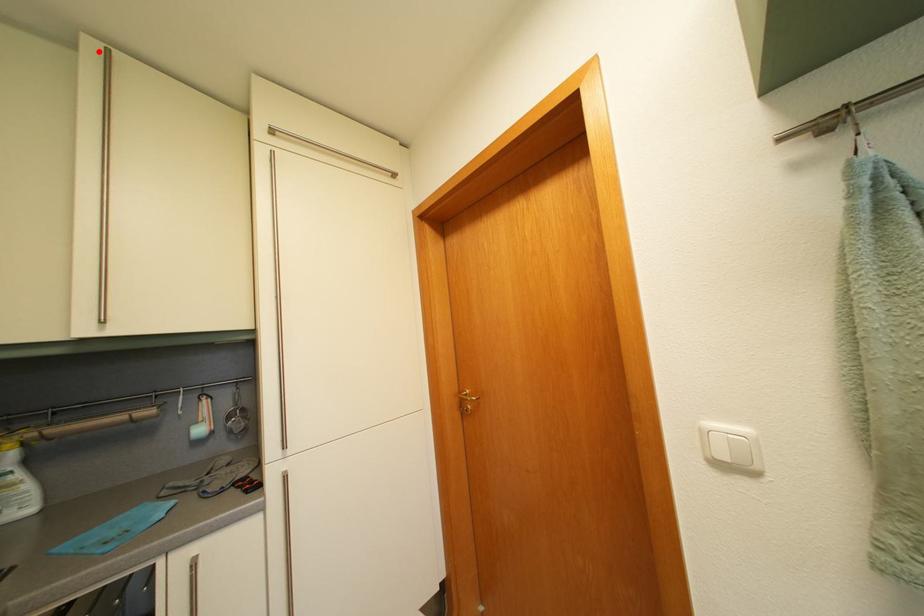
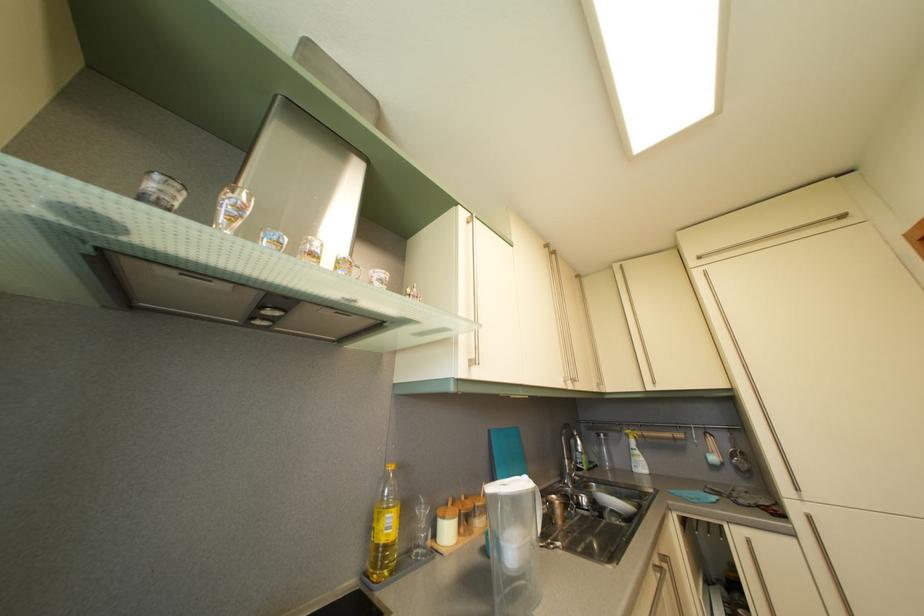
Find the pixel in the second image that matches the highlighted location in the first image.

(624, 274)